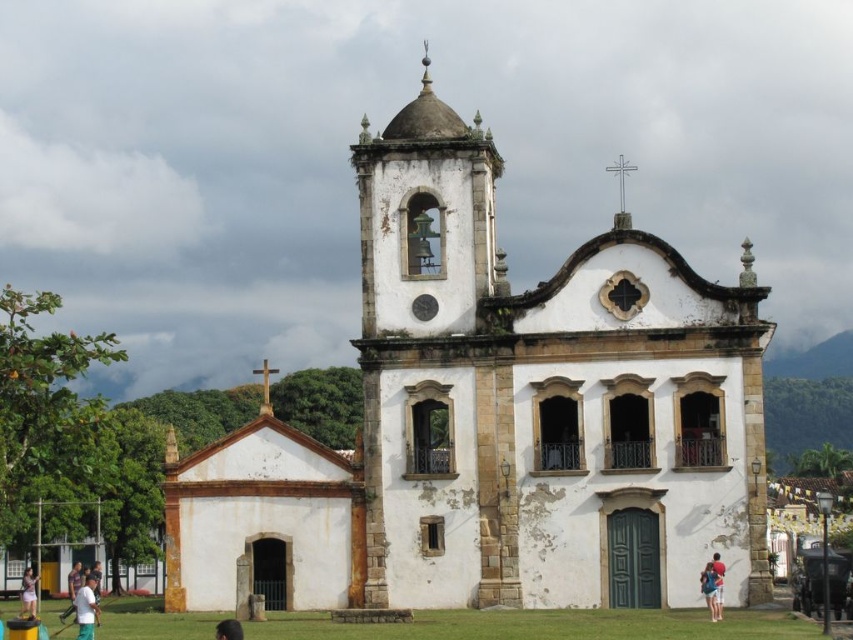
Question: Does white cotton shirt at lower left have a greater width compared to light brown wooden head at lower left?

Choices:
 (A) yes
 (B) no

Answer: (A)

Question: Which of the following is the farthest from the observer?

Choices:
 (A) (456, 364)
 (B) (94, 598)
 (C) (714, 584)
 (D) (74, 588)

Answer: (D)

Question: Which object is closer to the camera taking this photo?

Choices:
 (A) white cotton shirt at center
 (B) brown hair at lower center

Answer: (B)

Question: Which of these objects is positioned closest to the light brown wooden head at lower left?

Choices:
 (A) light blue denim shorts at lower center
 (B) brown hair at lower center
 (C) white cotton shirt at center
 (D) white stone chapel at center

Answer: (B)

Question: Does white cotton shirt at center have a greater width compared to brown hair at lower center?

Choices:
 (A) no
 (B) yes

Answer: (A)

Question: Does white stone chapel at center appear under brown hair at lower center?

Choices:
 (A) yes
 (B) no

Answer: (B)